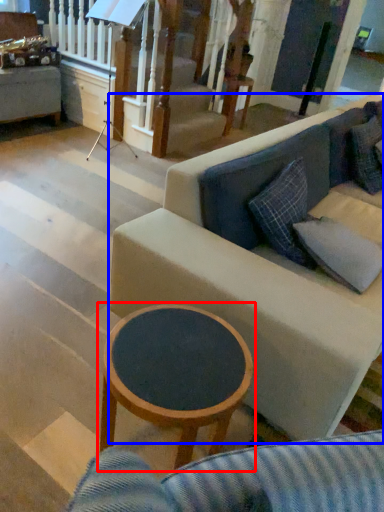
Question: Among these objects, which one is farthest to the camera, coffee table (highlighted by a red box) or studio couch (highlighted by a blue box)?

Choices:
 (A) coffee table
 (B) studio couch

Answer: (B)